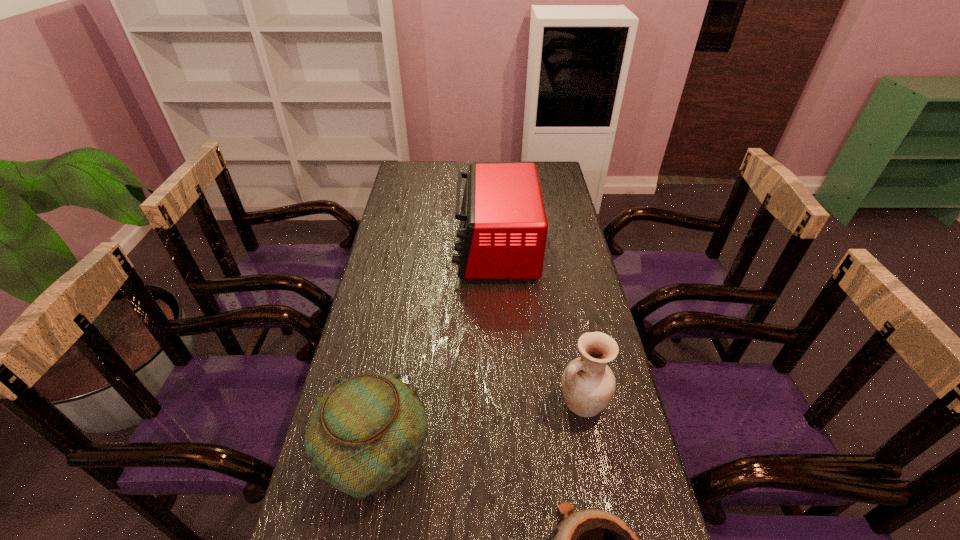
What are the coordinates of `free space at the far right corner of the desktop` in the screenshot? It's located at (526, 163).

Where is `empty location between the leftmost object and the farthest object`? This screenshot has height=540, width=960. empty location between the leftmost object and the farthest object is located at coordinates (435, 351).

I want to click on vacant area between the toaster oven and the leftmost pottery, so click(x=435, y=351).

Point out which object is positioned as the third nearest to the toaster oven. Please provide its 2D coordinates. Your answer should be formatted as a tuple, i.e. [(x, y)], where the tuple contains the x and y coordinates of a point satisfying the conditions above.

[(591, 539)]

Image resolution: width=960 pixels, height=540 pixels. I want to click on object that is the third nearest to the toaster oven, so click(591, 539).

The height and width of the screenshot is (540, 960). Identify the location of pottery that is the second closest to the leftmost object. click(x=588, y=384).

Identify the location of pottery that is the closest to the leftmost pottery. This screenshot has width=960, height=540. (591, 539).